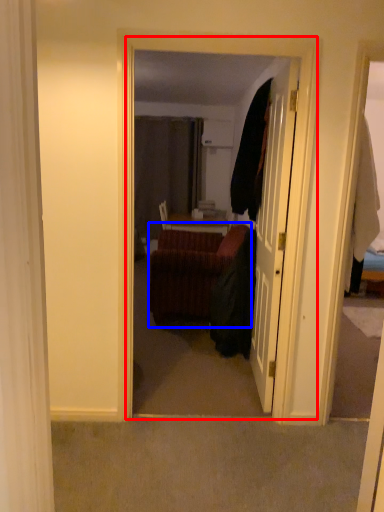
Question: Which object is further to the camera taking this photo, corridor (highlighted by a red box) or studio couch (highlighted by a blue box)?

Choices:
 (A) corridor
 (B) studio couch

Answer: (B)